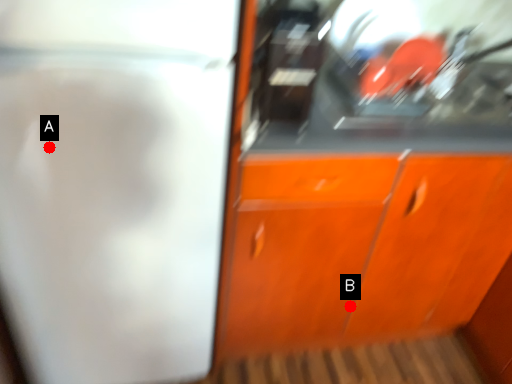
Question: Two points are circled on the image, labeled by A and B beside each circle. Which of the following is the farthest from the observer?

Choices:
 (A) A is further
 (B) B is further

Answer: (B)